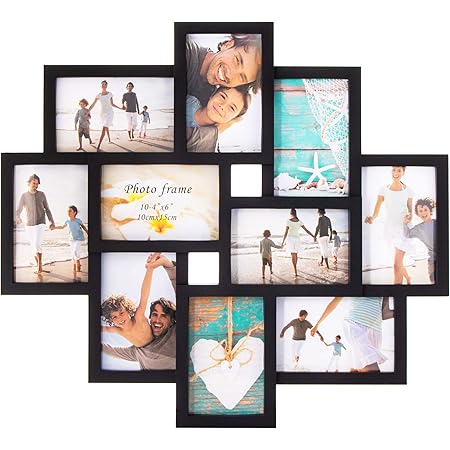
What are the coordinates of `individual pictures within the picture frame` in the screenshot? It's located at (110, 102), (244, 84), (297, 127), (393, 226), (308, 246), (168, 206), (42, 229), (135, 311), (213, 351), (324, 341).